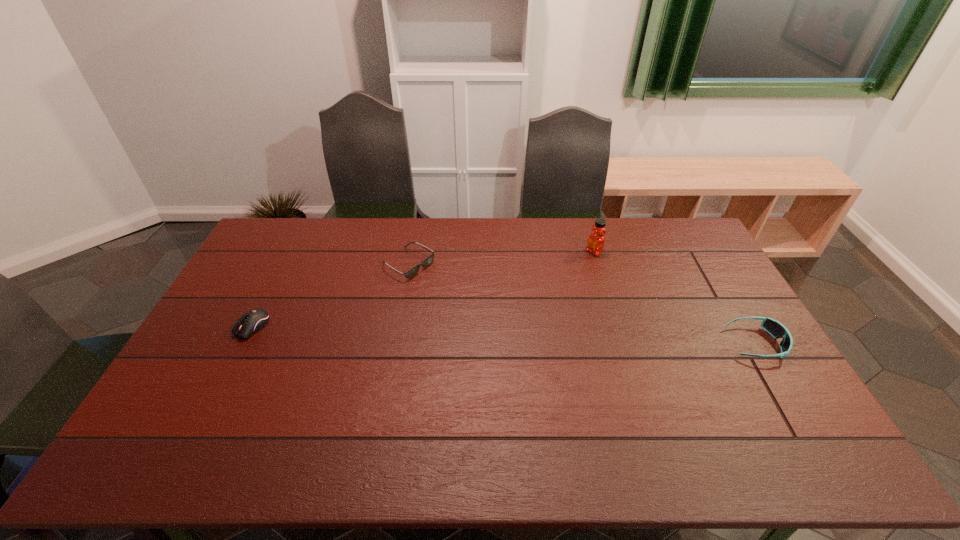
Where is `free space between the taller sunglasses and the left sunglasses`? The width and height of the screenshot is (960, 540). free space between the taller sunglasses and the left sunglasses is located at coordinates (582, 304).

Where is `vacant area that lies between the tallest object and the rightmost object`? vacant area that lies between the tallest object and the rightmost object is located at coordinates (675, 298).

Find the location of a particular element. The image size is (960, 540). free space between the tallest object and the computer mouse is located at coordinates (423, 289).

Find the location of a particular element. The height and width of the screenshot is (540, 960). object that is the closest to the taller sunglasses is located at coordinates (596, 241).

The width and height of the screenshot is (960, 540). What are the coordinates of `the third closest object to the third object from left to right` in the screenshot? It's located at (254, 320).

Find the location of a particular element. This screenshot has height=540, width=960. vacant point that satisfies the following two spatial constraints: 1. on the front side of the nearer sunglasses; 2. on the front-facing side of the honey is located at coordinates (622, 343).

Find the location of a particular element. The image size is (960, 540). vacant space that satisfies the following two spatial constraints: 1. on the back side of the computer mouse; 2. on the right side of the honey is located at coordinates (290, 252).

At what (x,y) coordinates should I click in order to perform the action: click on vacant position in the image that satisfies the following two spatial constraints: 1. on the back side of the honey; 2. on the right side of the shorter sunglasses. Please return your answer as a coordinate pair (x, y). The width and height of the screenshot is (960, 540). Looking at the image, I should click on (411, 252).

This screenshot has height=540, width=960. I want to click on vacant position in the image that satisfies the following two spatial constraints: 1. on the front side of the leftmost object; 2. on the front-facing side of the rightmost object, so click(x=244, y=343).